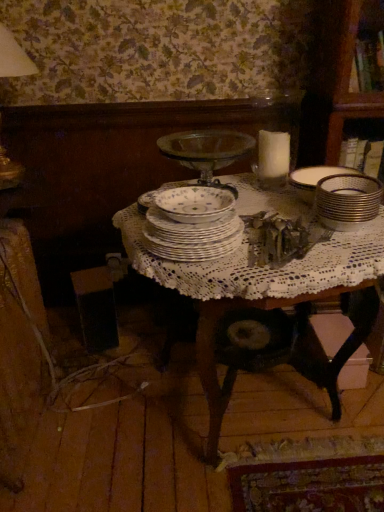
What do you see at coordinates (191, 237) in the screenshot? The height and width of the screenshot is (512, 384). I see `porcelain plates at center` at bounding box center [191, 237].

Measure the distance between point (x=322, y=198) and camera.

Point (x=322, y=198) and camera are 1.08 meters apart.

What do you see at coordinates (347, 201) in the screenshot? The image size is (384, 512). I see `gold metallic stack at right` at bounding box center [347, 201].

What are the coordinates of `porcelain plates at center` in the screenshot? It's located at (191, 237).

Considering the relative sizes of white lace tablecloth at center and porcelain floral bowl at center in the image provided, is white lace tablecloth at center taller than porcelain floral bowl at center?

Yes.

Looking at their sizes, would you say white lace tablecloth at center is wider or thinner than porcelain floral bowl at center?

In the image, white lace tablecloth at center appears to be wider than porcelain floral bowl at center.

Considering their positions, is white lace tablecloth at center located in front of or behind porcelain floral bowl at center?

white lace tablecloth at center is in front of porcelain floral bowl at center.

Is the surface of porcelain floral bowl at center in direct contact with gold metallic stack at right?

No.

Does porcelain floral bowl at center come behind gold metallic stack at right?

No, the depth of porcelain floral bowl at center is less than that of gold metallic stack at right.

Could you tell me if porcelain floral bowl at center is turned towards gold metallic stack at right?

No.

Does gold metallic stack at right have a larger size compared to porcelain plates at center?

No, gold metallic stack at right is not bigger than porcelain plates at center.

Is gold metallic stack at right surrounding porcelain plates at center?

No, porcelain plates at center is not surrounded by gold metallic stack at right.

Would you consider gold metallic stack at right to be distant from porcelain plates at center?

No, gold metallic stack at right is not far from porcelain plates at center.

Based on the photo, could you tell me if gold metallic stack at right is facing porcelain plates at center?

No, gold metallic stack at right is not oriented towards porcelain plates at center.

Is porcelain floral bowl at center behind porcelain plates at center?

Yes, porcelain floral bowl at center is behind porcelain plates at center.

How different are the orientations of porcelain floral bowl at center and porcelain plates at center in degrees?

0.000618 degrees separate the facing orientations of porcelain floral bowl at center and porcelain plates at center.

You are a GUI agent. You are given a task and a screenshot of the screen. Output one action in this format:
    pyautogui.click(x=<x>, y=<y>)
    Task: Click on the bowl lying on the left of porcelain plates at center
    Image resolution: width=384 pixels, height=512 pixels.
    Given the screenshot: What is the action you would take?
    pyautogui.click(x=195, y=203)

Considering the sizes of porcelain floral bowl at center and porcelain plates at center in the image, is porcelain floral bowl at center wider or thinner than porcelain plates at center?

In the image, porcelain floral bowl at center appears to be more narrow than porcelain plates at center.

Measure the distance between porcelain plates at center and gold metallic stack at right.

porcelain plates at center and gold metallic stack at right are 13.31 inches apart from each other.

Consider the image. Is porcelain plates at center touching gold metallic stack at right?

There is a gap between porcelain plates at center and gold metallic stack at right.

Would you say porcelain plates at center is to the left or to the right of gold metallic stack at right in the picture?

From the image, it's evident that porcelain plates at center is to the left of gold metallic stack at right.

Consider the image. Is gold metallic stack at right at the back of porcelain plates at center?

porcelain plates at center is not turned away from gold metallic stack at right.

In the scene shown: Is white lace tablecloth at center turned away from gold metallic stack at right?

No, white lace tablecloth at center is not facing away from gold metallic stack at right.

From the image's perspective, which is above, white lace tablecloth at center or gold metallic stack at right?

gold metallic stack at right, from the image's perspective.

Between white lace tablecloth at center and gold metallic stack at right, which one has smaller width?

Thinner between the two is gold metallic stack at right.

Between white lace tablecloth at center and gold metallic stack at right, which one has larger size?

With larger size is white lace tablecloth at center.

Based on the photo, which is more to the left, porcelain plates at center or white lace tablecloth at center?

porcelain plates at center is more to the left.

Is porcelain plates at center in front of white lace tablecloth at center?

No, porcelain plates at center is behind white lace tablecloth at center.

How many degrees apart are the facing directions of porcelain plates at center and white lace tablecloth at center?

They differ by 4.45 degrees in their facing directions.

From the image's perspective, between porcelain plates at center and white lace tablecloth at center, which one is located above?

porcelain plates at center, from the image's perspective.

Where is `table below the porcelain floral bowl at center (from a real-world perspective)`? The width and height of the screenshot is (384, 512). table below the porcelain floral bowl at center (from a real-world perspective) is located at coordinates (x=255, y=286).

You are a GUI agent. You are given a task and a screenshot of the screen. Output one action in this format:
    pyautogui.click(x=<x>, y=<y>)
    Task: Click on the tableware behind the porcelain floral bowl at center
    This screenshot has height=512, width=384.
    Given the screenshot: What is the action you would take?
    pyautogui.click(x=347, y=201)

Based on their spatial positions, is porcelain plates at center or porcelain floral bowl at center further from white lace tablecloth at center?

porcelain floral bowl at center is positioned further to the anchor white lace tablecloth at center.

Based on their spatial positions, is porcelain plates at center or gold metallic stack at right closer to white lace tablecloth at center?

Based on the image, porcelain plates at center appears to be nearer to white lace tablecloth at center.

Based on their spatial positions, is porcelain plates at center or white lace tablecloth at center further from porcelain floral bowl at center?

white lace tablecloth at center lies further to porcelain floral bowl at center than the other object.

Which object lies nearer to the anchor point porcelain floral bowl at center, white lace tablecloth at center or porcelain plates at center?

porcelain plates at center lies closer to porcelain floral bowl at center than the other object.

Looking at the image, which one is located closer to white lace tablecloth at center, porcelain floral bowl at center or porcelain plates at center?

porcelain plates at center lies closer to white lace tablecloth at center than the other object.

In the scene shown: Considering their positions, is porcelain floral bowl at center positioned closer to gold metallic stack at right than porcelain plates at center?

The object closer to gold metallic stack at right is porcelain floral bowl at center.

When comparing their distances from porcelain floral bowl at center, does white lace tablecloth at center or gold metallic stack at right seem further?

gold metallic stack at right lies further to porcelain floral bowl at center than the other object.

Looking at this image, looking at the image, which one is located closer to gold metallic stack at right, porcelain floral bowl at center or white lace tablecloth at center?

white lace tablecloth at center is positioned closer to the anchor gold metallic stack at right.

Locate an element on the screen. The height and width of the screenshot is (512, 384). table between porcelain plates at center and gold metallic stack at right from left to right is located at coordinates (255, 286).

Identify the location of table between porcelain floral bowl at center and gold metallic stack at right. (255, 286).

Where is `plate situated between porcelain floral bowl at center and gold metallic stack at right from left to right`? The width and height of the screenshot is (384, 512). plate situated between porcelain floral bowl at center and gold metallic stack at right from left to right is located at coordinates (191, 237).

Where is `plate between porcelain floral bowl at center and white lace tablecloth at center vertically`? This screenshot has width=384, height=512. plate between porcelain floral bowl at center and white lace tablecloth at center vertically is located at coordinates (191, 237).